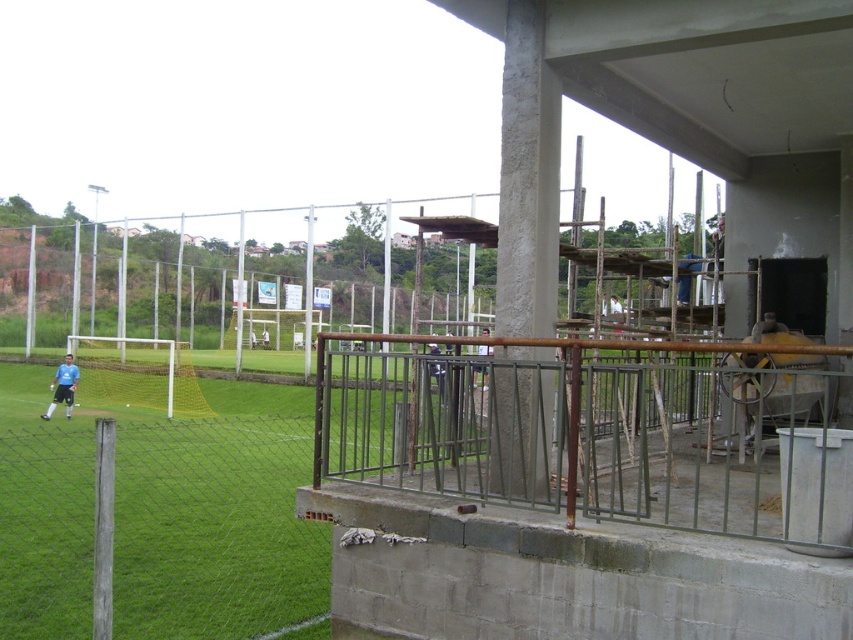
Question: Where is rusty metal railing at center located in relation to blue matte shirt at lower left in the image?

Choices:
 (A) right
 (B) left

Answer: (A)

Question: Considering the real-world distances, which object is closest to the blue matte shirt at lower left?

Choices:
 (A) rusty metal railing at center
 (B) blue fabric shirt at upper right

Answer: (B)

Question: Which object appears farthest from the camera in this image?

Choices:
 (A) blue matte shirt at lower left
 (B) rusty metal railing at center

Answer: (A)

Question: Observing the image, what is the correct spatial positioning of rusty metal railing at center in reference to blue matte shirt at lower left?

Choices:
 (A) below
 (B) above

Answer: (B)

Question: Considering the real-world distances, which object is closest to the rusty metal railing at center?

Choices:
 (A) blue matte shirt at lower left
 (B) blue fabric shirt at upper right

Answer: (B)

Question: Can you confirm if blue fabric shirt at upper right is thinner than blue matte shirt at lower left?

Choices:
 (A) no
 (B) yes

Answer: (A)